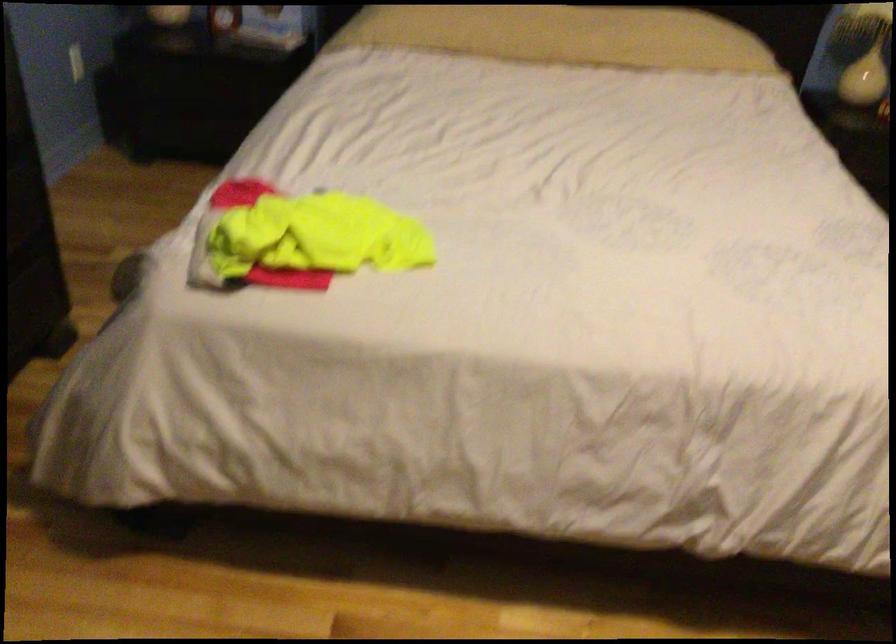
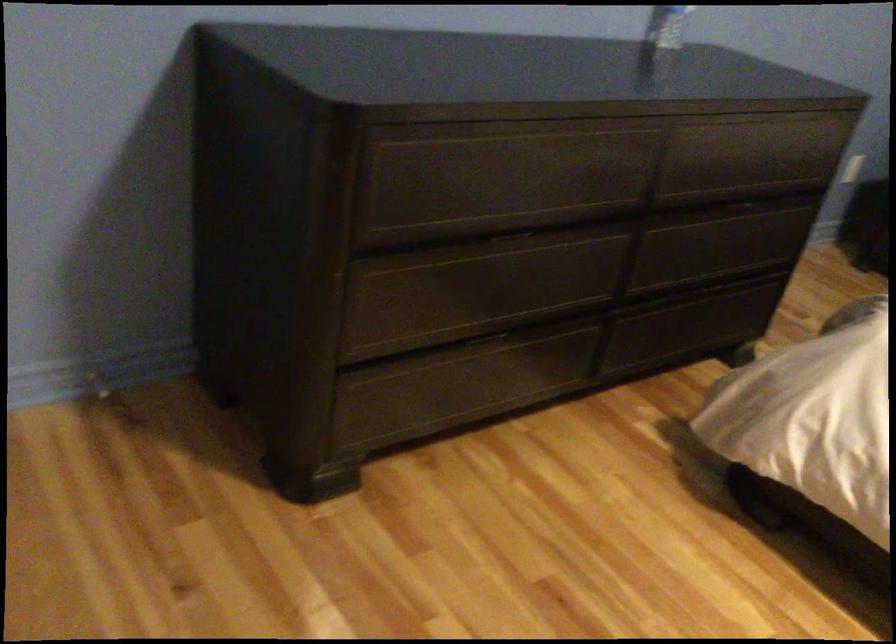
Question: The first image is from the beginning of the video and the second image is from the end. How did the camera likely rotate when shooting the video?

Choices:
 (A) Left
 (B) Right
 (C) Up
 (D) Down

Answer: (A)